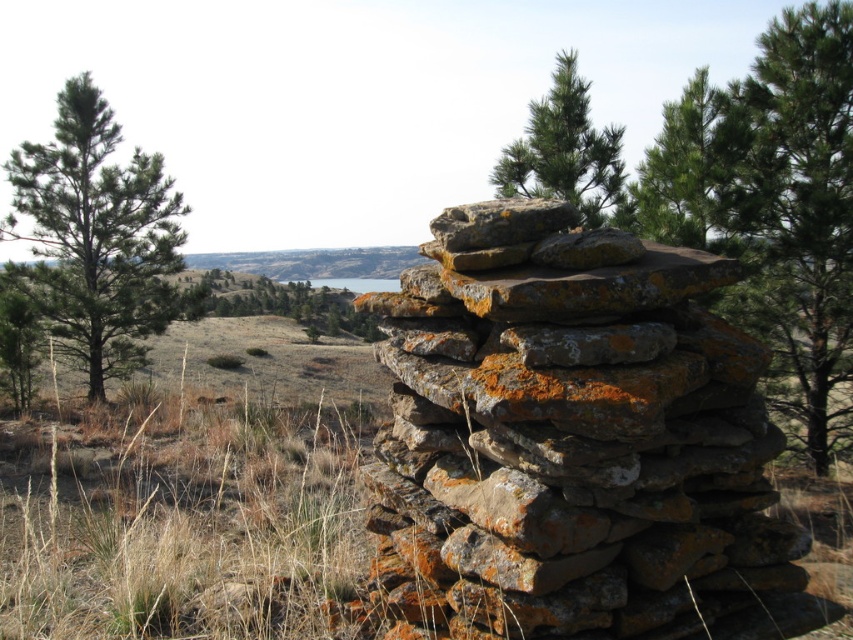
Question: Is green needle-like tree at right bigger than green lichen-covered rock at upper center?

Choices:
 (A) yes
 (B) no

Answer: (B)

Question: Which object is closer to the camera taking this photo?

Choices:
 (A) green needle-like tree at right
 (B) green lichen-covered rock at upper center
 (C) green rough bark tree at left
 (D) rusty stone stack at center

Answer: (D)

Question: Among these points, which one is farthest from the camera?

Choices:
 (A) (161, 362)
 (B) (3, 221)
 (C) (807, 76)
 (D) (712, 260)

Answer: (A)

Question: Does green rough bark tree at left have a larger size compared to green leafy tree at center?

Choices:
 (A) yes
 (B) no

Answer: (B)

Question: Is green needle-like tree at right thinner than green rough bark tree at left?

Choices:
 (A) no
 (B) yes

Answer: (B)

Question: Which point appears closest to the camera in this image?

Choices:
 (A) (550, 225)
 (B) (750, 307)

Answer: (A)